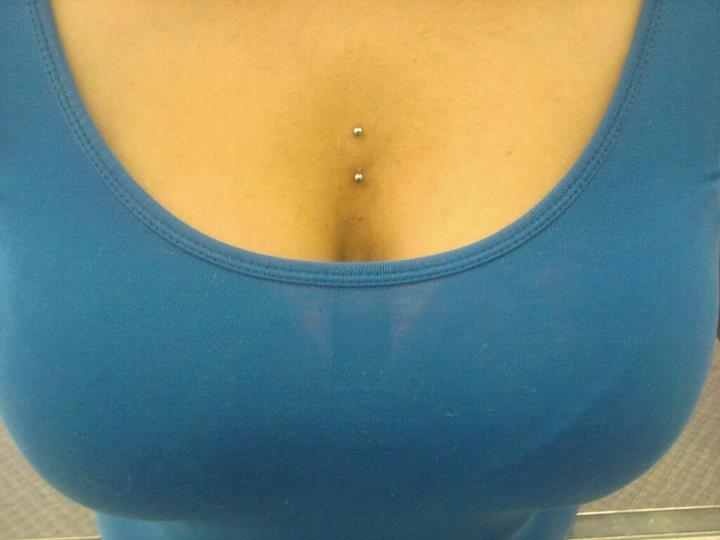
Find the location of a particular element. floor is located at coordinates point(701,480), point(37,504).